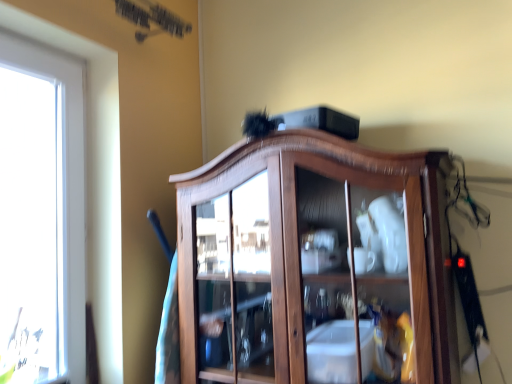
What do you see at coordinates (311, 261) in the screenshot? I see `wooden cabinet at center` at bounding box center [311, 261].

Locate an element on the screen. wooden cabinet at center is located at coordinates (311, 261).

Find the location of a particular element. The image size is (512, 384). wooden cabinet at center is located at coordinates (311, 261).